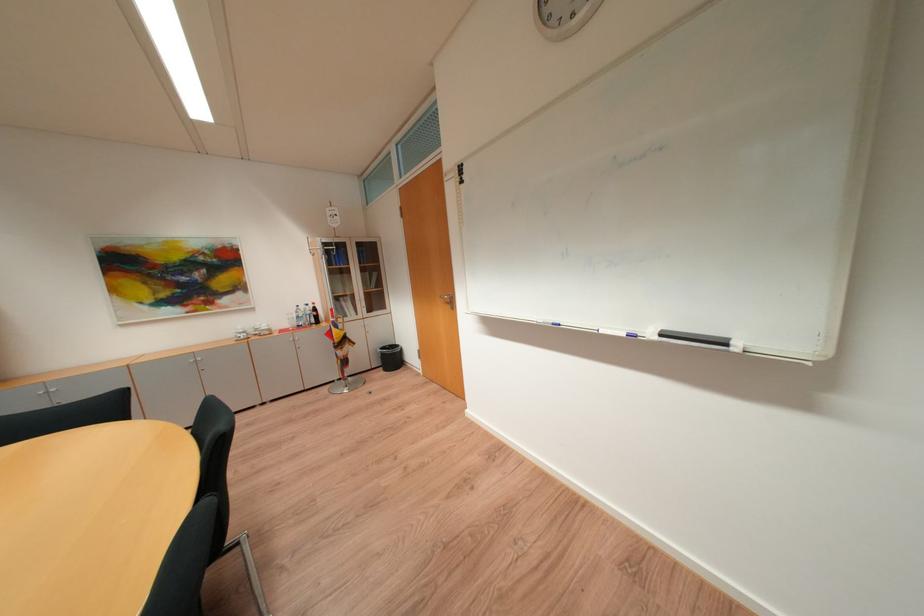
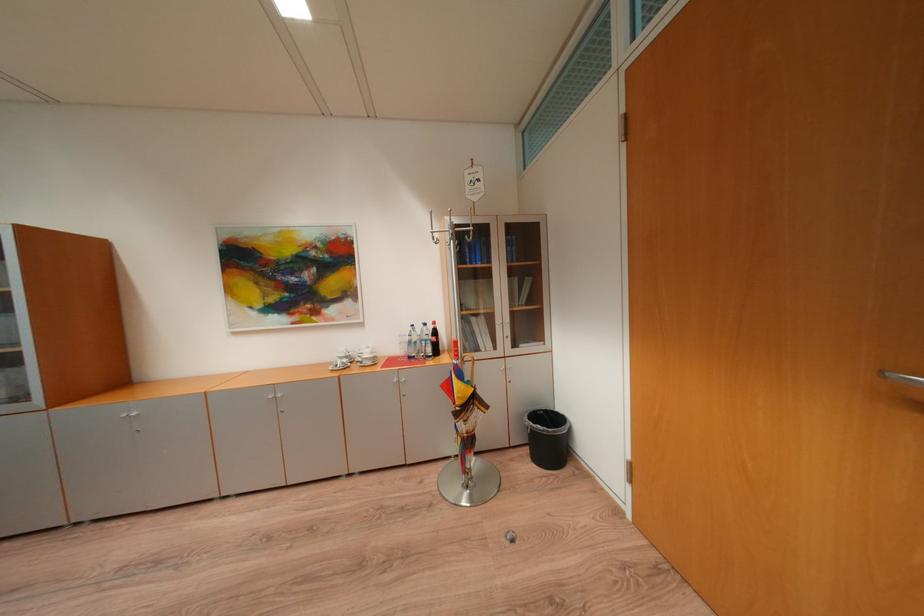
In a continuous first-person perspective shot, in which direction is the camera moving?

The movement direction of the cameraman is left, forward.